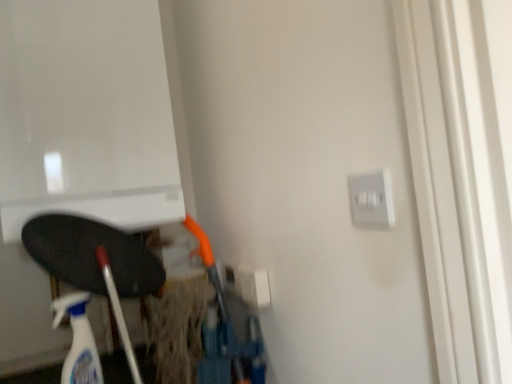
The width and height of the screenshot is (512, 384). Describe the element at coordinates (371, 199) in the screenshot. I see `satin silver switch at upper right, the first electric outlet when ordered from front to back` at that location.

The width and height of the screenshot is (512, 384). What are the coordinates of `translucent plastic spray bottle at lower left` in the screenshot? It's located at (78, 341).

This screenshot has height=384, width=512. In order to click on satin silver switch at upper right, which appears as the 1th electric outlet when viewed from the top in this screenshot , I will do `click(371, 199)`.

Considering the sizes of objects white plastic electric outlet at center-right, positioned as the 1th electric outlet in back-to-front order, and translucent plastic spray bottle at lower left in the image provided, who is shorter, white plastic electric outlet at center-right, positioned as the 1th electric outlet in back-to-front order, or translucent plastic spray bottle at lower left?

white plastic electric outlet at center-right, positioned as the 1th electric outlet in back-to-front order, is shorter.

Can you confirm if white plastic electric outlet at center-right, arranged as the first electric outlet when viewed from the left, is positioned to the right of translucent plastic spray bottle at lower left?

Indeed, white plastic electric outlet at center-right, arranged as the first electric outlet when viewed from the left, is positioned on the right side of translucent plastic spray bottle at lower left.

From the image's perspective, does white plastic electric outlet at center-right, arranged as the first electric outlet when viewed from the left, appear higher than translucent plastic spray bottle at lower left?

Indeed, from the image's perspective, white plastic electric outlet at center-right, arranged as the first electric outlet when viewed from the left, is shown above translucent plastic spray bottle at lower left.

Does point (246, 268) lie in front of point (59, 305)?

No.

Is translucent plastic spray bottle at lower left not near satin silver switch at upper right, which appears as the second electric outlet when ordered from the bottom?

Actually, translucent plastic spray bottle at lower left and satin silver switch at upper right, which appears as the second electric outlet when ordered from the bottom, are a little close together.

Is translucent plastic spray bottle at lower left further to the viewer compared to satin silver switch at upper right, the first electric outlet when ordered from front to back?

Yes.

Which is nearer, (64, 315) or (374, 218)?

Point (64, 315) is farther from the camera than point (374, 218).

How many degrees apart are the facing directions of satin silver switch at upper right, which appears as the 1th electric outlet when viewed from the top, and white plastic electric outlet at center-right, arranged as the 2th electric outlet when viewed from the top?

The angle between the facing direction of satin silver switch at upper right, which appears as the 1th electric outlet when viewed from the top, and the facing direction of white plastic electric outlet at center-right, arranged as the 2th electric outlet when viewed from the top, is 0.0221 degrees.

Is the depth of satin silver switch at upper right, the second electric outlet from the left, greater than that of white plastic electric outlet at center-right, which ranks as the 2th electric outlet in front-to-back order?

No, satin silver switch at upper right, the second electric outlet from the left, is in front of white plastic electric outlet at center-right, which ranks as the 2th electric outlet in front-to-back order.

Does satin silver switch at upper right, the first electric outlet when ordered from front to back, have a smaller size compared to white plastic electric outlet at center-right, which ranks as the 2th electric outlet in front-to-back order?

Yes, satin silver switch at upper right, the first electric outlet when ordered from front to back, is smaller than white plastic electric outlet at center-right, which ranks as the 2th electric outlet in front-to-back order.

Considering the sizes of objects satin silver switch at upper right, which appears as the second electric outlet when ordered from the bottom, and white plastic electric outlet at center-right, arranged as the first electric outlet when viewed from the left, in the image provided, who is taller, satin silver switch at upper right, which appears as the second electric outlet when ordered from the bottom, or white plastic electric outlet at center-right, arranged as the first electric outlet when viewed from the left,?

Answer: With more height is satin silver switch at upper right, which appears as the second electric outlet when ordered from the bottom.

Considering the positions of objects satin silver switch at upper right, which appears as the second electric outlet when ordered from the bottom, and translucent plastic spray bottle at lower left in the image provided, who is behind, satin silver switch at upper right, which appears as the second electric outlet when ordered from the bottom, or translucent plastic spray bottle at lower left?

translucent plastic spray bottle at lower left.

Which point is more forward, [392,219] or [84,316]?

Positioned in front is point [392,219].

Between satin silver switch at upper right, which appears as the second electric outlet when ordered from the bottom, and translucent plastic spray bottle at lower left, which one has more height?

With more height is translucent plastic spray bottle at lower left.

From a real-world perspective, is satin silver switch at upper right, which appears as the second electric outlet when ordered from the bottom, below translucent plastic spray bottle at lower left?

No.

Is white plastic electric outlet at center-right, which ranks as the 2th electric outlet in front-to-back order, facing towards satin silver switch at upper right, the first electric outlet when ordered from front to back?

No, white plastic electric outlet at center-right, which ranks as the 2th electric outlet in front-to-back order, is not oriented towards satin silver switch at upper right, the first electric outlet when ordered from front to back.

Is white plastic electric outlet at center-right, arranged as the first electric outlet when viewed from the left, in front of or behind satin silver switch at upper right, the 1th electric outlet when ordered from right to left, in the image?

Visually, white plastic electric outlet at center-right, arranged as the first electric outlet when viewed from the left, is located behind satin silver switch at upper right, the 1th electric outlet when ordered from right to left.

Could satin silver switch at upper right, the 1th electric outlet when ordered from right to left, be considered to be inside white plastic electric outlet at center-right, arranged as the 2th electric outlet when viewed from the top?

No, satin silver switch at upper right, the 1th electric outlet when ordered from right to left, is not surrounded by white plastic electric outlet at center-right, arranged as the 2th electric outlet when viewed from the top.

Between white plastic electric outlet at center-right, which ranks as the first electric outlet in bottom-to-top order, and satin silver switch at upper right, the first electric outlet when ordered from front to back, which one appears on the left side from the viewer's perspective?

white plastic electric outlet at center-right, which ranks as the first electric outlet in bottom-to-top order.

In the scene shown: Considering the sizes of objects translucent plastic spray bottle at lower left and white plastic electric outlet at center-right, arranged as the first electric outlet when viewed from the left, in the image provided, who is thinner, translucent plastic spray bottle at lower left or white plastic electric outlet at center-right, arranged as the first electric outlet when viewed from the left,?

white plastic electric outlet at center-right, arranged as the first electric outlet when viewed from the left, is thinner.

Does translucent plastic spray bottle at lower left turn towards white plastic electric outlet at center-right, which ranks as the 2th electric outlet in front-to-back order?

No, translucent plastic spray bottle at lower left is not turned towards white plastic electric outlet at center-right, which ranks as the 2th electric outlet in front-to-back order.

Considering the relative sizes of translucent plastic spray bottle at lower left and white plastic electric outlet at center-right, positioned as the 1th electric outlet in back-to-front order, in the image provided, is translucent plastic spray bottle at lower left shorter than white plastic electric outlet at center-right, positioned as the 1th electric outlet in back-to-front order,?

No, translucent plastic spray bottle at lower left is not shorter than white plastic electric outlet at center-right, positioned as the 1th electric outlet in back-to-front order.

The width and height of the screenshot is (512, 384). I want to click on cleaning product in front of the white plastic electric outlet at center-right, arranged as the second electric outlet when viewed from the right, so click(x=78, y=341).

You are a GUI agent. You are given a task and a screenshot of the screen. Output one action in this format:
    pyautogui.click(x=<x>, y=<y>)
    Task: Click on the cleaning product below the satin silver switch at upper right, which appears as the second electric outlet when ordered from the bottom (from the image's perspective)
    The height and width of the screenshot is (384, 512).
    Given the screenshot: What is the action you would take?
    pyautogui.click(x=78, y=341)

Which object lies nearer to the anchor point white plastic electric outlet at center-right, positioned as the 1th electric outlet in back-to-front order, translucent plastic spray bottle at lower left or satin silver switch at upper right, placed as the second electric outlet when sorted from back to front?

translucent plastic spray bottle at lower left is positioned closer to the anchor white plastic electric outlet at center-right, positioned as the 1th electric outlet in back-to-front order.

Estimate the real-world distances between objects in this image. Which object is closer to translucent plastic spray bottle at lower left, white plastic electric outlet at center-right, positioned as the 1th electric outlet in back-to-front order, or satin silver switch at upper right, placed as the second electric outlet when sorted from back to front?

The object closer to translucent plastic spray bottle at lower left is white plastic electric outlet at center-right, positioned as the 1th electric outlet in back-to-front order.

Which object lies nearer to the anchor point satin silver switch at upper right, which appears as the second electric outlet when ordered from the bottom, white plastic electric outlet at center-right, arranged as the second electric outlet when viewed from the right, or translucent plastic spray bottle at lower left?

white plastic electric outlet at center-right, arranged as the second electric outlet when viewed from the right, is positioned closer to the anchor satin silver switch at upper right, which appears as the second electric outlet when ordered from the bottom.

Estimate the real-world distances between objects in this image. Which object is further from white plastic electric outlet at center-right, which ranks as the first electric outlet in bottom-to-top order, satin silver switch at upper right, which appears as the 1th electric outlet when viewed from the top, or translucent plastic spray bottle at lower left?

satin silver switch at upper right, which appears as the 1th electric outlet when viewed from the top, is further to white plastic electric outlet at center-right, which ranks as the first electric outlet in bottom-to-top order.

Which object lies further to the anchor point translucent plastic spray bottle at lower left, satin silver switch at upper right, the second electric outlet from the left, or white plastic electric outlet at center-right, which ranks as the 2th electric outlet in front-to-back order?

The object further to translucent plastic spray bottle at lower left is satin silver switch at upper right, the second electric outlet from the left.

From the image, which object appears to be nearer to satin silver switch at upper right, the 1th electric outlet when ordered from right to left, translucent plastic spray bottle at lower left or white plastic electric outlet at center-right, arranged as the 2th electric outlet when viewed from the top?

white plastic electric outlet at center-right, arranged as the 2th electric outlet when viewed from the top.

I want to click on electric outlet located between translucent plastic spray bottle at lower left and satin silver switch at upper right, which appears as the second electric outlet when ordered from the bottom, in the left-right direction, so click(253, 285).